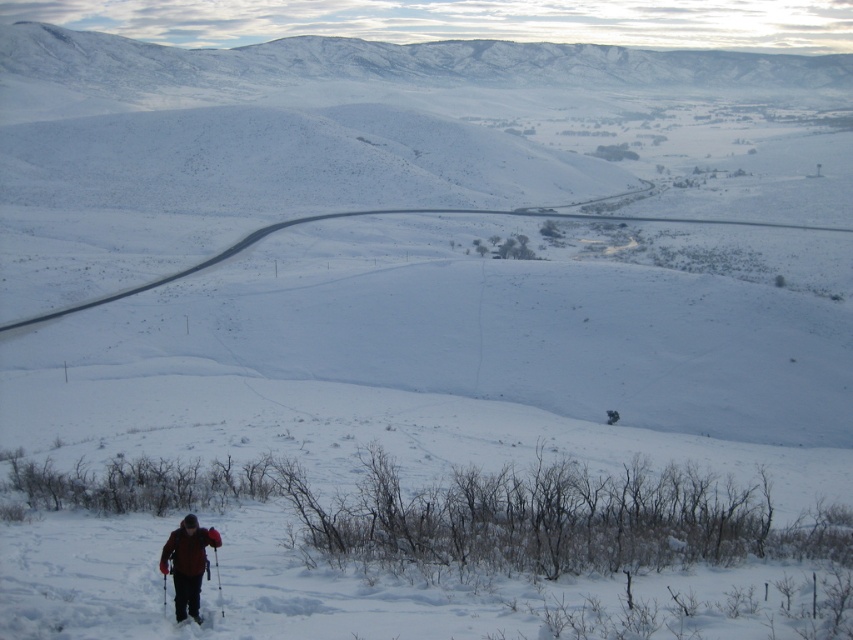
You are a hiker trying to locate your gear. You see a red fleece jacket at lower left and a black matte ski at lower left. Which item is positioned more to the left?

The red fleece jacket at lower left is positioned more to the left than the black matte ski at lower left.